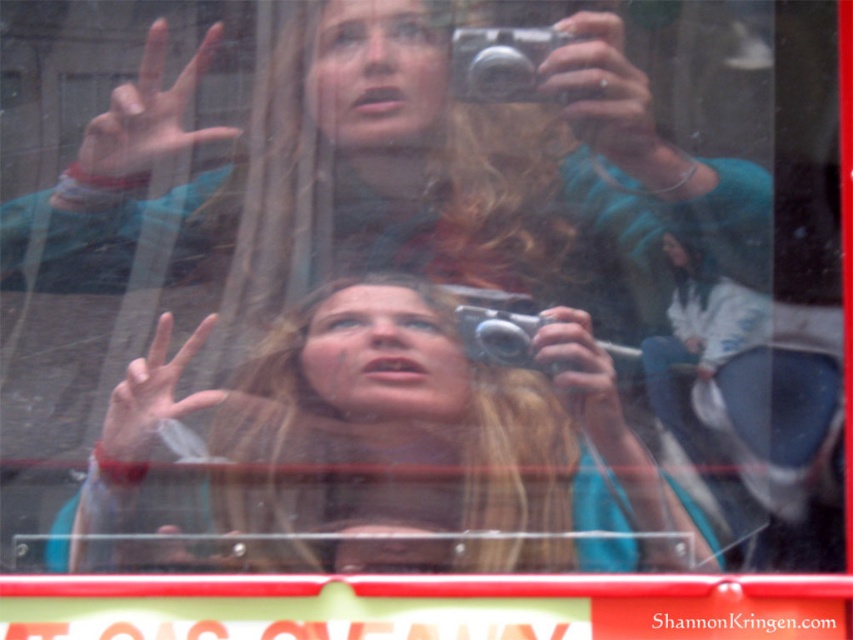
Question: Which point is closer to the camera taking this photo?

Choices:
 (A) (482, 333)
 (B) (593, 141)
 (C) (531, 90)
 (D) (138, 156)

Answer: (D)

Question: Does matte plastic hand at center appear under silver metallic camera at upper center?

Choices:
 (A) yes
 (B) no

Answer: (A)

Question: Does matte plastic hand at center appear under silver metallic camera at center?

Choices:
 (A) no
 (B) yes

Answer: (B)

Question: Which of these objects is positioned farthest from the metallic silver camera at upper center?

Choices:
 (A) light skin tone hand at upper center
 (B) silver metallic camera at center

Answer: (A)

Question: Which point appears farthest from the camera in this image?

Choices:
 (A) (457, 52)
 (B) (257, 451)
 (C) (611, 20)

Answer: (A)

Question: Can you confirm if matte plastic hand at center is thinner than silver metallic camera at upper center?

Choices:
 (A) no
 (B) yes

Answer: (B)